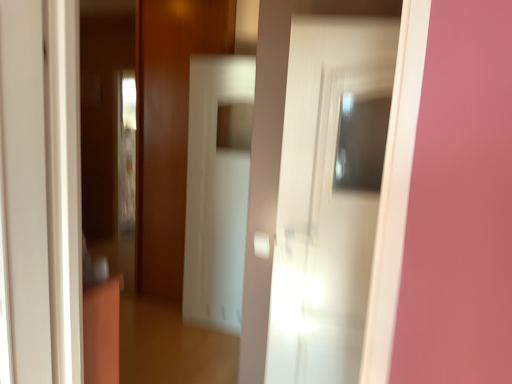
What do you see at coordinates (324, 203) in the screenshot? I see `white glossy door at center, arranged as the first door when viewed from the right` at bounding box center [324, 203].

What do you see at coordinates (216, 193) in the screenshot?
I see `white glossy screen door at center` at bounding box center [216, 193].

The image size is (512, 384). What do you see at coordinates (24, 194) in the screenshot?
I see `white glossy door at left, which is counted as the second door, starting from the back` at bounding box center [24, 194].

The image size is (512, 384). I want to click on white glossy door at center, the 1th door from the back, so click(324, 203).

Which is further, (x=217, y=77) or (x=12, y=12)?

The point (x=217, y=77) is farther.

Based on the photo, is white glossy door at left, the second door viewed from the right, at the back of white glossy screen door at center?

white glossy screen door at center is not turned away from white glossy door at left, the second door viewed from the right.

From a real-world perspective, is white glossy screen door at center physically located above or below white glossy door at left, which is counted as the second door, starting from the back?

white glossy screen door at center is situated lower than white glossy door at left, which is counted as the second door, starting from the back, in the real world.

From the image's perspective, between white glossy screen door at center and white glossy door at left, which is the 1th door from left to right, which one is located above?

white glossy screen door at center, from the image's perspective.

Which object is wider, white glossy screen door at center or white glossy door at center, arranged as the first door when viewed from the right?

Wider between the two is white glossy screen door at center.

From the image's perspective, who appears lower, white glossy screen door at center or white glossy door at center, arranged as the first door when viewed from the right?

white glossy door at center, arranged as the first door when viewed from the right, is shown below in the image.

Between white glossy screen door at center and white glossy door at center, acting as the second door starting from the left, which one has less height?

With less height is white glossy door at center, acting as the second door starting from the left.

Is white glossy door at center, the 1th door from the back, not close to white glossy door at left, which is the 1th door from left to right?

Absolutely, white glossy door at center, the 1th door from the back, is distant from white glossy door at left, which is the 1th door from left to right.

Does white glossy door at center, arranged as the first door when viewed from the right, appear on the right side of white glossy door at left, the 1th door viewed from the front?

Yes, white glossy door at center, arranged as the first door when viewed from the right, is to the right of white glossy door at left, the 1th door viewed from the front.

Considering the sizes of objects white glossy door at center, placed as the 2th door when sorted from front to back, and white glossy door at left, which is counted as the second door, starting from the back, in the image provided, who is smaller, white glossy door at center, placed as the 2th door when sorted from front to back, or white glossy door at left, which is counted as the second door, starting from the back,?

Smaller between the two is white glossy door at left, which is counted as the second door, starting from the back.

Between white glossy door at center, placed as the 2th door when sorted from front to back, and white glossy door at left, which is the 1th door from left to right, which one is positioned in front?

white glossy door at left, which is the 1th door from left to right, is closer to the camera.

Does point (330, 333) appear closer or farther from the camera than point (195, 319)?

Clearly, point (330, 333) is closer to the camera than point (195, 319).

Identify the location of screen door lying above the white glossy door at center, placed as the 2th door when sorted from front to back (from the image's perspective). The width and height of the screenshot is (512, 384). click(x=216, y=193).

Considering the sizes of objects white glossy door at center, acting as the second door starting from the left, and white glossy screen door at center in the image provided, who is taller, white glossy door at center, acting as the second door starting from the left, or white glossy screen door at center?

Standing taller between the two is white glossy screen door at center.

Does white glossy door at center, acting as the second door starting from the left, have a greater width compared to white glossy screen door at center?

No, white glossy door at center, acting as the second door starting from the left, is not wider than white glossy screen door at center.

Between point (40, 376) and point (204, 246), which one is positioned in front?

The point (40, 376) is closer to the camera.

This screenshot has width=512, height=384. Identify the location of screen door above the white glossy door at left, which is the 1th door from left to right (from the image's perspective). (216, 193).

Can you confirm if white glossy door at left, which is counted as the second door, starting from the back, is bigger than white glossy screen door at center?

Actually, white glossy door at left, which is counted as the second door, starting from the back, might be smaller than white glossy screen door at center.

Is the position of white glossy door at left, the 1th door viewed from the front, less distant than that of white glossy screen door at center?

Yes, white glossy door at left, the 1th door viewed from the front, is closer to the viewer.

Is point (18, 178) positioned in front of point (282, 218)?

Yes, point (18, 178) is closer to viewer.

Considering the sizes of objects white glossy door at left, which is counted as the second door, starting from the back, and white glossy door at center, placed as the 2th door when sorted from front to back, in the image provided, who is thinner, white glossy door at left, which is counted as the second door, starting from the back, or white glossy door at center, placed as the 2th door when sorted from front to back,?

Thinner between the two is white glossy door at center, placed as the 2th door when sorted from front to back.

How different are the orientations of white glossy door at left, which is counted as the second door, starting from the back, and white glossy door at center, arranged as the first door when viewed from the right, in degrees?

There is a 76.8-degree angle between the facing directions of white glossy door at left, which is counted as the second door, starting from the back, and white glossy door at center, arranged as the first door when viewed from the right.

At what (x,y) coordinates should I click in order to perform the action: click on door beneath the white glossy door at left, which is the 1th door from left to right (from a real-world perspective). Please return your answer as a coordinate pair (x, y). The image size is (512, 384). Looking at the image, I should click on [x=324, y=203].

In the image, there is a white glossy door at left, the second door viewed from the right. Where is `screen door below it (from a real-world perspective)`? screen door below it (from a real-world perspective) is located at coordinates (216, 193).

Find the location of `screen door behind the white glossy door at center, acting as the second door starting from the left`. screen door behind the white glossy door at center, acting as the second door starting from the left is located at coordinates (216, 193).

Considering their positions, is white glossy screen door at center positioned further to white glossy door at left, the second door viewed from the right, than white glossy door at center, the 1th door from the back?

white glossy screen door at center.

Consider the image. From the image, which object appears to be farther from white glossy door at center, placed as the 2th door when sorted from front to back, white glossy screen door at center or white glossy door at left, which is counted as the second door, starting from the back?

white glossy screen door at center is further to white glossy door at center, placed as the 2th door when sorted from front to back.

From the image, which object appears to be farther from white glossy door at left, the 1th door viewed from the front, white glossy door at center, the 1th door from the back, or white glossy screen door at center?

Based on the image, white glossy screen door at center appears to be further to white glossy door at left, the 1th door viewed from the front.

Which object lies nearer to the anchor point white glossy screen door at center, white glossy door at center, acting as the second door starting from the left, or white glossy door at left, the second door viewed from the right?

white glossy door at center, acting as the second door starting from the left, is positioned closer to the anchor white glossy screen door at center.

From the image, which object appears to be farther from white glossy door at center, placed as the 2th door when sorted from front to back, white glossy door at left, which is counted as the second door, starting from the back, or white glossy screen door at center?

white glossy screen door at center is further to white glossy door at center, placed as the 2th door when sorted from front to back.

Based on their spatial positions, is white glossy door at left, which is counted as the second door, starting from the back, or white glossy door at center, arranged as the first door when viewed from the right, closer to white glossy screen door at center?

white glossy door at center, arranged as the first door when viewed from the right, is positioned closer to the anchor white glossy screen door at center.

Locate an element on the screen. The height and width of the screenshot is (384, 512). door positioned between white glossy door at left, the second door viewed from the right, and white glossy screen door at center from near to far is located at coordinates (324, 203).